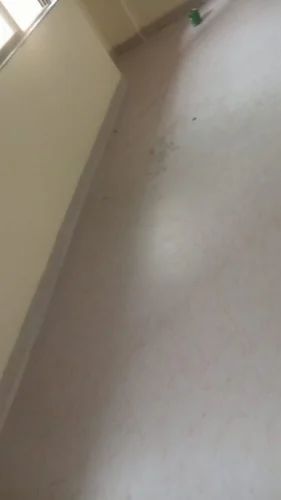
You are a GUI agent. You are given a task and a screenshot of the screen. Output one action in this format:
    pyautogui.click(x=<x>, y=<y>)
    Task: Click on the window
    The width and height of the screenshot is (281, 500).
    Given the screenshot: What is the action you would take?
    pyautogui.click(x=18, y=16), pyautogui.click(x=0, y=32)